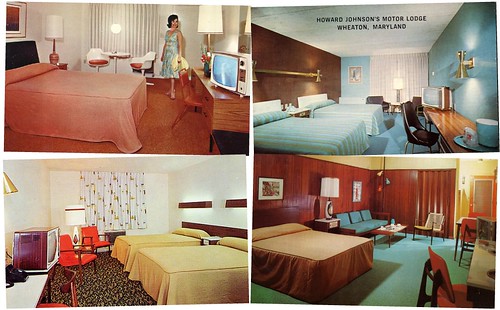
Identify the location of carpet. The height and width of the screenshot is (310, 500). (177, 142), (383, 140), (409, 283), (101, 292).